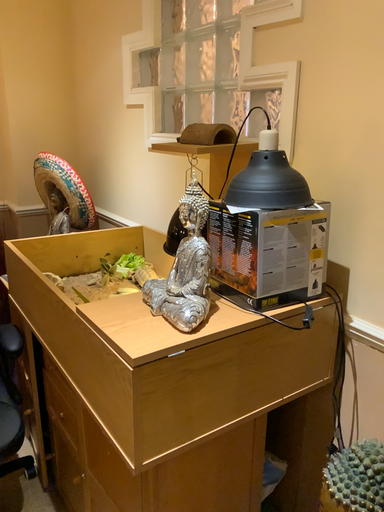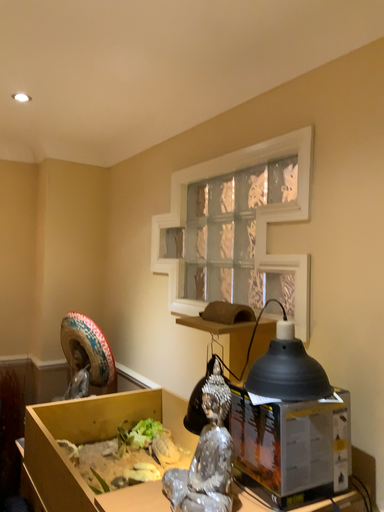
Question: How did the camera likely rotate when shooting the video?

Choices:
 (A) rotated upward
 (B) rotated downward

Answer: (A)